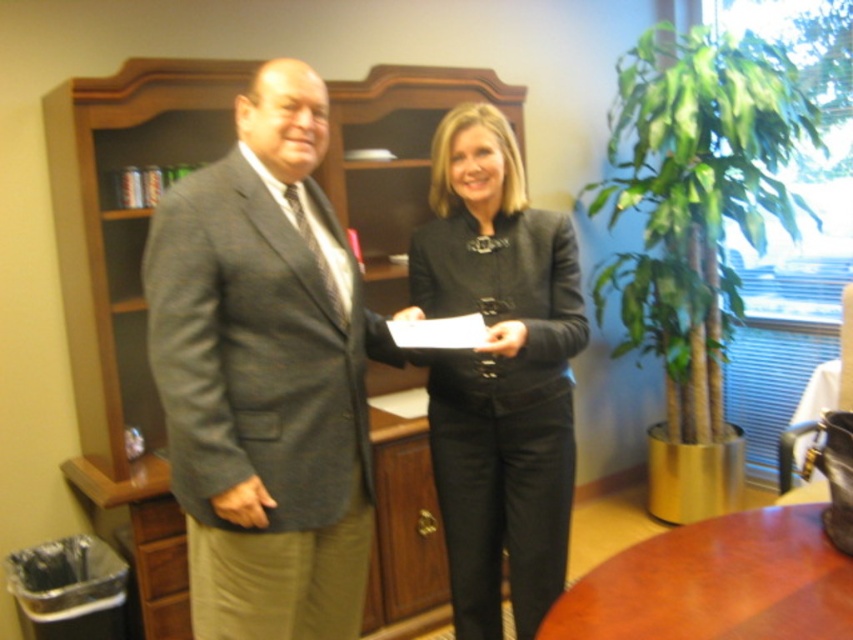
You are an interior designer assessing the placement of clothing items in an office scene. The gray wool suit at center and black matte blazer at center are displayed on a rack. Which clothing item is shorter in height?

The gray wool suit at center is not as tall as the black matte blazer at center, so the gray wool suit at center is shorter in height.

Consider the image. You are a photographer standing in the office and want to take a photo of the gray wool suit at center and the brown wooden table at center. If your camera can only capture objects within 25 inches of each other, will both objects fit in the frame?

The gray wool suit at center is 28.23 inches from the brown wooden table at center, which exceeds the camera frame limit of 25 inches. Therefore, both objects cannot fit in the frame together.

You are a photographer in an office setting and need to adjust your camera focus. You have two points to focus on in the image. The first point is at coordinates point (515, 145) and the second is at point (769, 600). Which point should you focus on first if you want to capture the closest object to the camera?

Point (515, 145) is further to the viewer than point (769, 600), so you should focus on point (515, 145) first as it is closer to the camera.